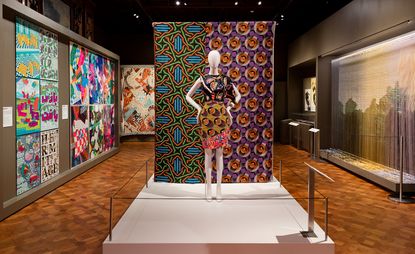
Locate an element on the screen. This screenshot has height=254, width=415. floor is located at coordinates (339, 191).